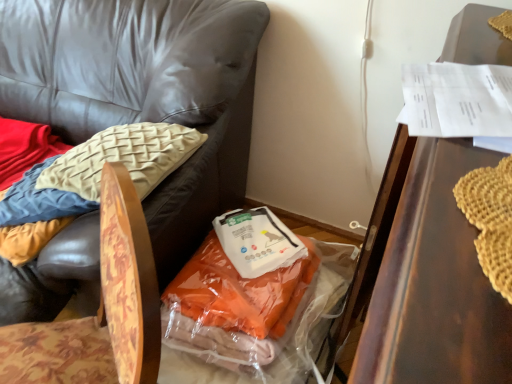
Question: From the image's perspective, is translucent plastic bag at center beneath floral fabric chair at lower left, which is counted as the 1th chair, starting from the right?

Choices:
 (A) no
 (B) yes

Answer: (A)

Question: Is translucent plastic bag at center beside floral fabric chair at lower left, which is counted as the 1th chair, starting from the right?

Choices:
 (A) yes
 (B) no

Answer: (B)

Question: Is translucent plastic bag at center completely or partially outside of floral fabric chair at lower left, the second chair positioned from the left?

Choices:
 (A) yes
 (B) no

Answer: (A)

Question: Considering the relative sizes of translucent plastic bag at center and floral fabric chair at lower left, which is counted as the 1th chair, starting from the right, in the image provided, is translucent plastic bag at center thinner than floral fabric chair at lower left, which is counted as the 1th chair, starting from the right,?

Choices:
 (A) no
 (B) yes

Answer: (B)

Question: Can you confirm if translucent plastic bag at center is positioned to the left of floral fabric chair at lower left, the second chair positioned from the left?

Choices:
 (A) no
 (B) yes

Answer: (A)

Question: Considering the relative sizes of translucent plastic bag at center and floral fabric chair at lower left, the second chair positioned from the left, in the image provided, is translucent plastic bag at center taller than floral fabric chair at lower left, the second chair positioned from the left,?

Choices:
 (A) yes
 (B) no

Answer: (B)

Question: Is translucent plastic bag at center smaller than translucent plastic bag at center?

Choices:
 (A) yes
 (B) no

Answer: (A)

Question: Could you tell me if translucent plastic bag at center is facing translucent plastic bag at center?

Choices:
 (A) no
 (B) yes

Answer: (B)

Question: Can you see translucent plastic bag at center touching translucent plastic bag at center?

Choices:
 (A) yes
 (B) no

Answer: (B)

Question: Is translucent plastic bag at center surrounding translucent plastic bag at center?

Choices:
 (A) yes
 (B) no

Answer: (B)

Question: From a real-world perspective, is translucent plastic bag at center physically above translucent plastic bag at center?

Choices:
 (A) no
 (B) yes

Answer: (B)

Question: From the image's perspective, is translucent plastic bag at center over translucent plastic bag at center?

Choices:
 (A) no
 (B) yes

Answer: (B)

Question: Is translucent plastic bag at center smaller than wooden textured chair at lower left, arranged as the first chair when viewed from the left?

Choices:
 (A) no
 (B) yes

Answer: (B)